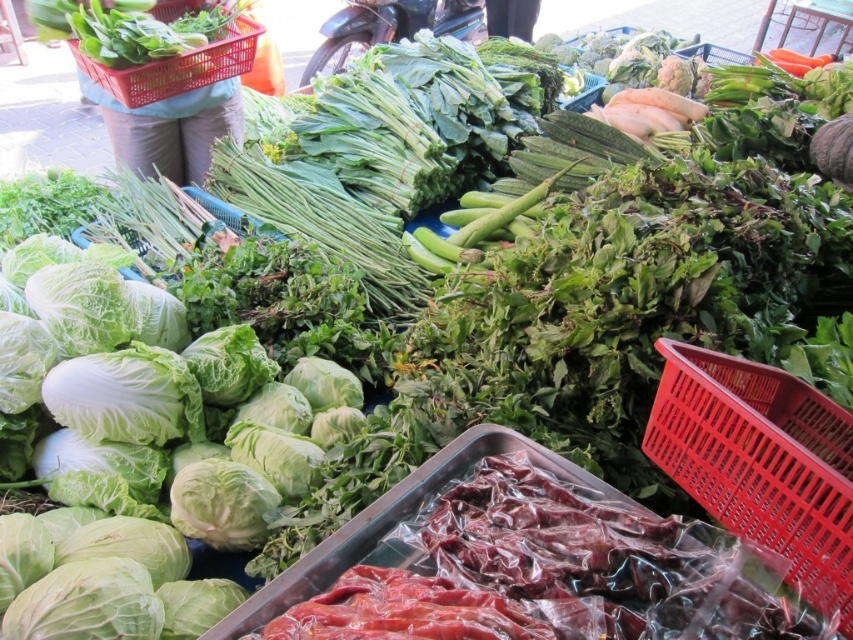
In the scene shown: Does red plastic basket at upper right have a greater height compared to red plastic basket at upper left?

Incorrect, red plastic basket at upper right's height is not larger of red plastic basket at upper left's.

Does red plastic basket at upper right have a lesser width compared to red plastic basket at upper left?

Correct, red plastic basket at upper right's width is less than red plastic basket at upper left's.

You are a GUI agent. You are given a task and a screenshot of the screen. Output one action in this format:
    pyautogui.click(x=<x>, y=<y>)
    Task: Click on the red plastic basket at upper right
    The width and height of the screenshot is (853, 640).
    Given the screenshot: What is the action you would take?
    pyautogui.click(x=761, y=461)

I want to click on red plastic basket at upper right, so point(761,461).